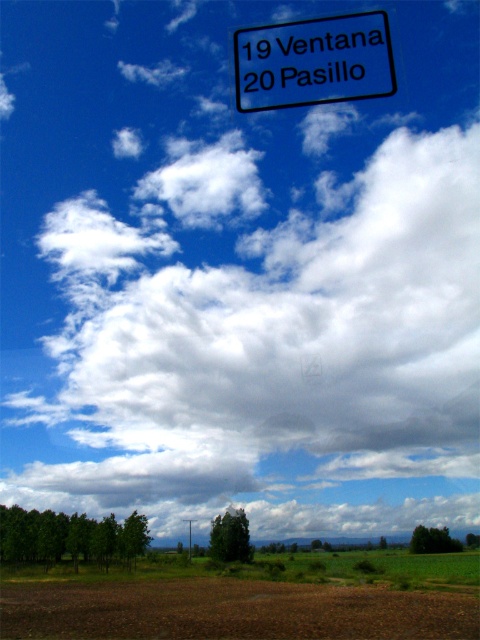
You are standing at the point marked by the coordinate point at (x=43, y=531). You want to walk straight ahead. How far will you have to walk before you reach the edge of the scene?

Since the point at (x=43, y=531) is 81.62 meters away from the edge of the scene, you will have to walk 81.62 meters to reach it.

You are a gardener planning to plant a tree in the brown soil at lower center. Since the metallic pole at center is in the way, will you need to adjust the planting position to avoid it?

The brown soil at lower center is located above the metallic pole at center, so the pole is below the soil. Therefore, you can plant the tree in the brown soil at lower center without needing to adjust the position because the metallic pole at center is underneath.